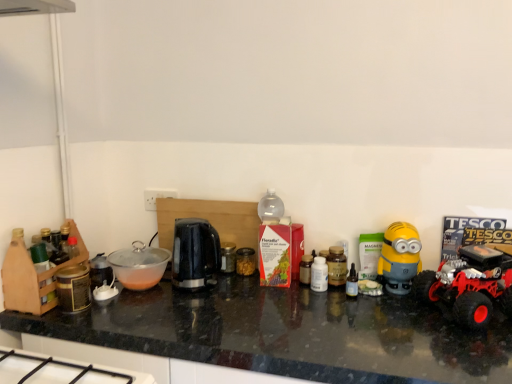
Identify the location of free location in front of red rubber toy truck at right. (x=472, y=354).